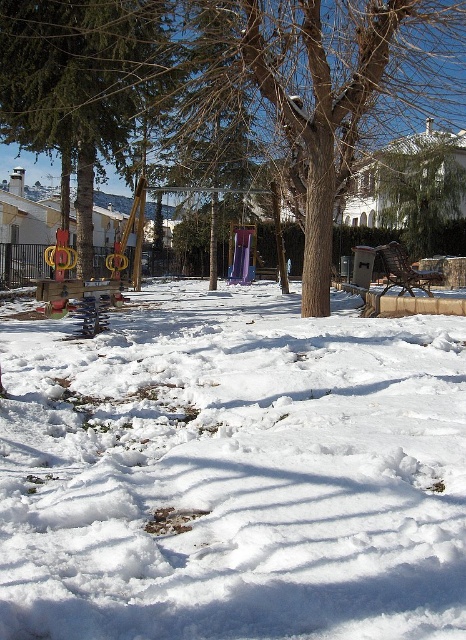
Who is positioned more to the right, white fluffy snow at center or green matte tree at upper left?

white fluffy snow at center is more to the right.

Does white fluffy snow at center have a lesser height compared to green matte tree at upper left?

In fact, white fluffy snow at center may be taller than green matte tree at upper left.

Does point (56, 372) come behind point (121, 170)?

No, (56, 372) is in front of (121, 170).

Locate an element on the screen. This screenshot has height=640, width=466. white fluffy snow at center is located at coordinates (233, 474).

Can you confirm if white fluffy snow at center is positioned above brown wood tree at center?

No, white fluffy snow at center is not above brown wood tree at center.

Can you confirm if white fluffy snow at center is positioned to the left of brown wood tree at center?

Yes, white fluffy snow at center is to the left of brown wood tree at center.

Identify the location of white fluffy snow at center. The width and height of the screenshot is (466, 640). [233, 474].

Does brown wood tree at center have a larger size compared to green matte tree at upper left?

Yes, brown wood tree at center is bigger than green matte tree at upper left.

Is brown wood tree at center taller than green matte tree at upper left?

Yes, brown wood tree at center is taller than green matte tree at upper left.

Who is more forward, (34, 93) or (6, 3)?

Positioned in front is point (6, 3).

Where is `brown wood tree at center`? brown wood tree at center is located at coordinates (230, 72).